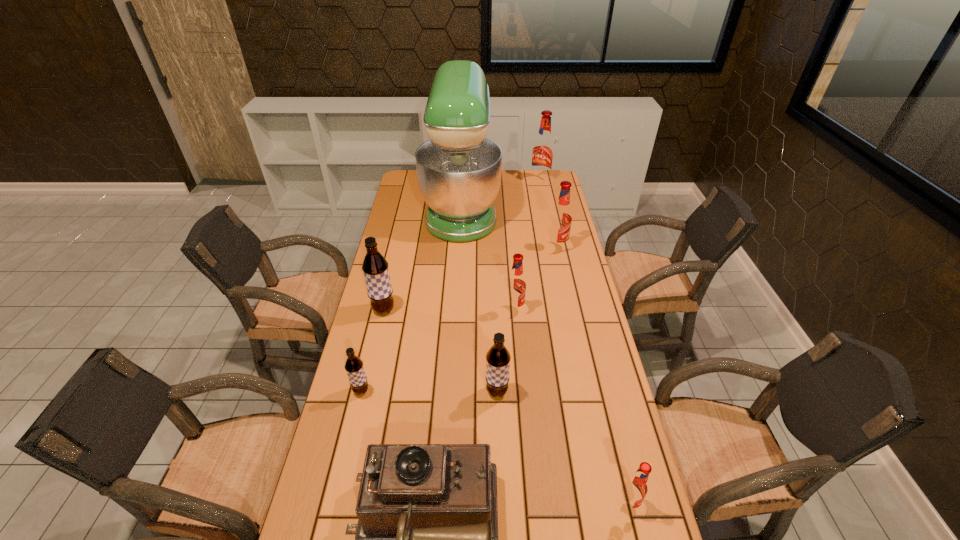
You are a GUI agent. You are given a task and a screenshot of the screen. Output one action in this format:
    pyautogui.click(x=<x>, y=<y>)
    Task: Click on the vacant area that lies between the smallest brown root beer and the second biggest brown root beer
    
    Given the screenshot: What is the action you would take?
    429,391

What are the coordinates of `free spot between the nearest root beer and the biggest brown root beer` in the screenshot? It's located at (506, 407).

The image size is (960, 540). Identify the location of free point between the nearest red root beer and the third nearest red root beer. (592, 376).

At what (x,y) coordinates should I click in order to perform the action: click on vacant area that lies between the leftmost red root beer and the green mixer. Please return your answer as a coordinate pair (x, y). Looking at the image, I should click on (488, 259).

At what (x,y) coordinates should I click in order to perform the action: click on unoccupied position between the biggest brown root beer and the nearest red root beer. Please return your answer as a coordinate pair (x, y). Looking at the image, I should click on (506, 407).

At what (x,y) coordinates should I click in order to perform the action: click on empty location between the biggest brown root beer and the smallest brown root beer. Please return your answer as a coordinate pair (x, y). This screenshot has width=960, height=540. Looking at the image, I should click on (372, 350).

Identify the location of object that ranks as the third closest to the phonograph_record. This screenshot has height=540, width=960. (635, 488).

Identify which object is the fifth closest to the second biggest brown root beer. Please provide its 2D coordinates. Your answer should be formatted as a tuple, i.e. [(x, y)], where the tuple contains the x and y coordinates of a point satisfying the conditions above.

[(375, 267)]

Identify the location of root beer that is the fourth closest to the third nearest red root beer. (498, 358).

Select which root beer appears as the third closest to the smallest red root beer. Please provide its 2D coordinates. Your answer should be formatted as a tuple, i.e. [(x, y)], where the tuple contains the x and y coordinates of a point satisfying the conditions above.

[(354, 367)]